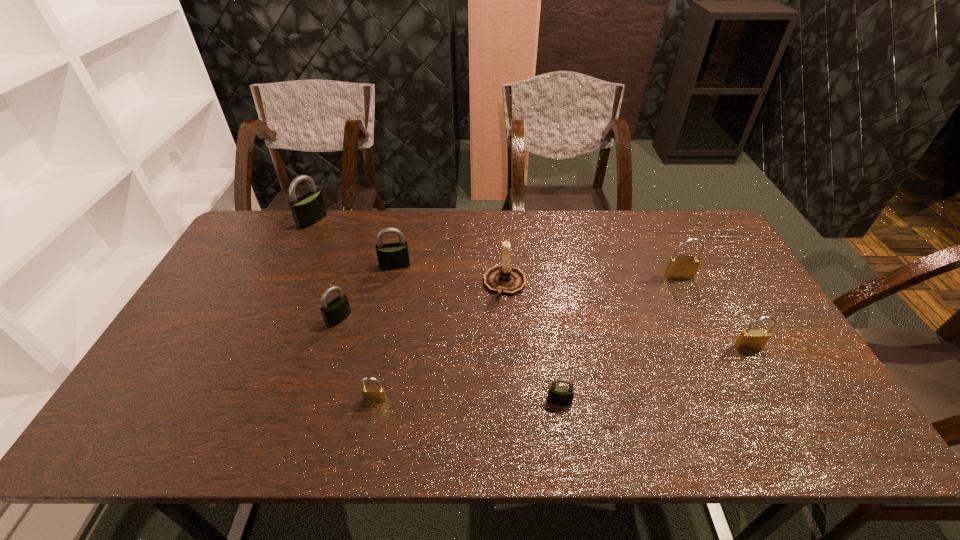
At what (x,y) coordinates should I click in order to perform the action: click on vacant space that satisfies the following two spatial constraints: 1. on the front side of the fifth padlock from left to right; 2. on the right side of the second biggest black padlock. Please return your answer as a coordinate pair (x, y). Looking at the image, I should click on (367, 401).